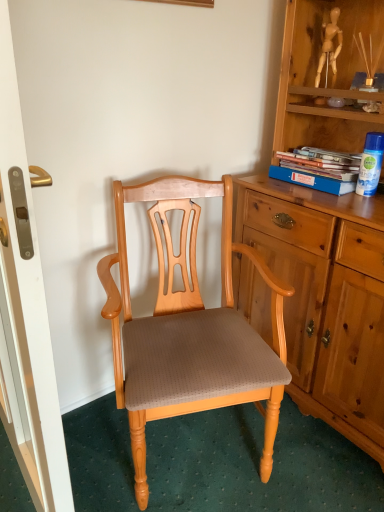
Question: Does blue cardboard book at upper right appear on the right side of matte wood screen door at left?

Choices:
 (A) yes
 (B) no

Answer: (A)

Question: Does blue cardboard book at upper right come behind matte wood screen door at left?

Choices:
 (A) no
 (B) yes

Answer: (B)

Question: Could you tell me if blue cardboard book at upper right is turned towards matte wood screen door at left?

Choices:
 (A) no
 (B) yes

Answer: (B)

Question: Can you confirm if blue cardboard book at upper right is smaller than matte wood screen door at left?

Choices:
 (A) yes
 (B) no

Answer: (A)

Question: Is blue cardboard book at upper right taller than matte wood screen door at left?

Choices:
 (A) no
 (B) yes

Answer: (A)

Question: Is point (165, 332) closer or farther from the camera than point (44, 509)?

Choices:
 (A) farther
 (B) closer

Answer: (A)

Question: In terms of width, does light brown wood chair at center look wider or thinner when compared to matte wood screen door at left?

Choices:
 (A) wide
 (B) thin

Answer: (A)

Question: Based on their positions, is light brown wood chair at center located to the left or right of matte wood screen door at left?

Choices:
 (A) left
 (B) right

Answer: (B)

Question: In terms of height, does light brown wood chair at center look taller or shorter compared to matte wood screen door at left?

Choices:
 (A) tall
 (B) short

Answer: (B)

Question: Is light brown wood chair at center bigger or smaller than blue cardboard book at upper right?

Choices:
 (A) big
 (B) small

Answer: (A)

Question: Is light brown wood chair at center situated inside blue cardboard book at upper right or outside?

Choices:
 (A) inside
 (B) outside

Answer: (B)

Question: Is light brown wood chair at center wider or thinner than blue cardboard book at upper right?

Choices:
 (A) wide
 (B) thin

Answer: (A)

Question: From the image's perspective, is light brown wood chair at center located above or below blue cardboard book at upper right?

Choices:
 (A) below
 (B) above

Answer: (A)

Question: Considering the positions of point (329, 190) and point (6, 121), is point (329, 190) closer or farther from the camera than point (6, 121)?

Choices:
 (A) farther
 (B) closer

Answer: (A)

Question: From the image's perspective, is blue cardboard book at upper right positioned above or below matte wood screen door at left?

Choices:
 (A) above
 (B) below

Answer: (A)